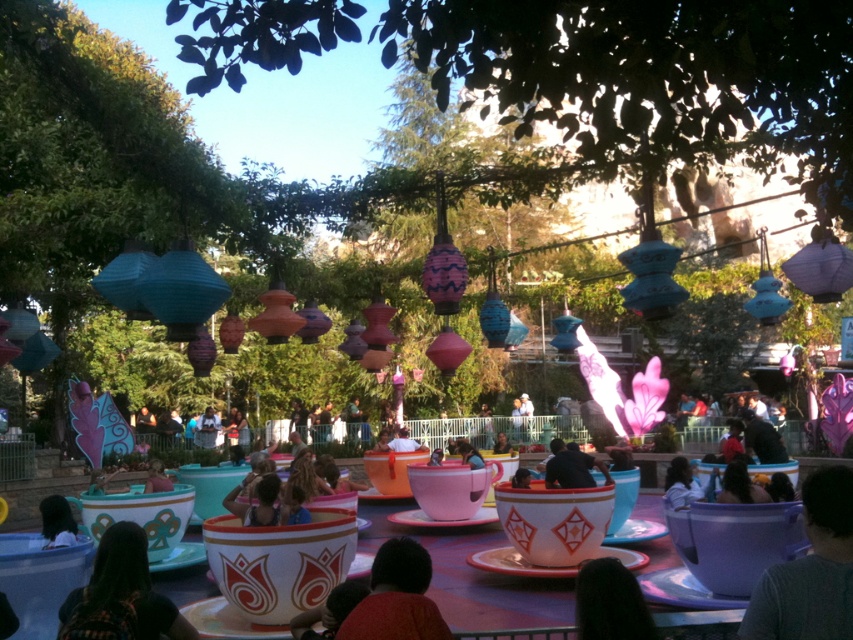
Is point (727, 500) behind point (152, 460)?

No.

Identify the location of dark brown hair at center. This screenshot has height=640, width=853. (740, 486).

Can you confirm if dark hair at lower left is positioned above matte blue shirt at center?

Correct, dark hair at lower left is located above matte blue shirt at center.

This screenshot has height=640, width=853. What are the coordinates of `dark hair at lower left` in the screenshot? It's located at (57, 522).

You are a GUI agent. You are given a task and a screenshot of the screen. Output one action in this format:
    pyautogui.click(x=<x>, y=<y>)
    Task: Click on the dark hair at lower left
    The width and height of the screenshot is (853, 640).
    Given the screenshot: What is the action you would take?
    pyautogui.click(x=57, y=522)

Between point (807, 524) and point (65, 630), which one is positioned in front?

Point (807, 524)

Describe the element at coordinates (810, 570) in the screenshot. This screenshot has height=640, width=853. I see `dark gray shirt at lower right` at that location.

The height and width of the screenshot is (640, 853). Find the location of `dark gray shirt at lower right`. dark gray shirt at lower right is located at coordinates (810, 570).